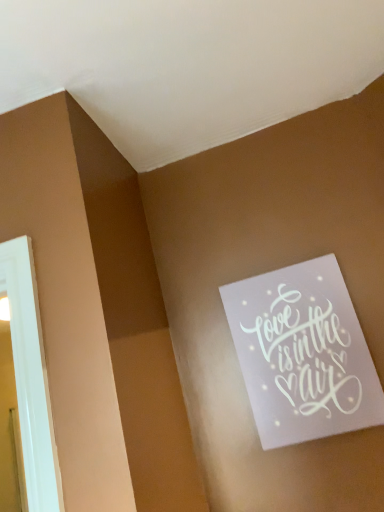
What do you see at coordinates (307, 353) in the screenshot? The height and width of the screenshot is (512, 384). I see `white glossy lettering at upper right` at bounding box center [307, 353].

In order to face white glossy lettering at upper right, should I rotate leftwards or rightwards?

To face it directly, rotate right by 14.468 degrees.

You are a GUI agent. You are given a task and a screenshot of the screen. Output one action in this format:
    pyautogui.click(x=<x>, y=<y>)
    Task: Click on the white glossy lettering at upper right
    
    Given the screenshot: What is the action you would take?
    pyautogui.click(x=307, y=353)

At what (x,y) coordinates should I click in order to perform the action: click on white glossy lettering at upper right. Please return your answer as a coordinate pair (x, y). The width and height of the screenshot is (384, 512). Looking at the image, I should click on (307, 353).